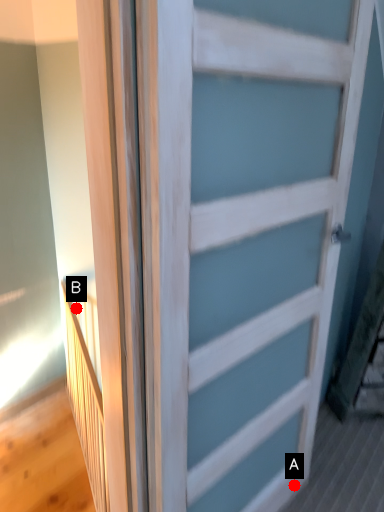
Question: Two points are circled on the image, labeled by A and B beside each circle. Which point is closer to the camera?

Choices:
 (A) A is closer
 (B) B is closer

Answer: (A)